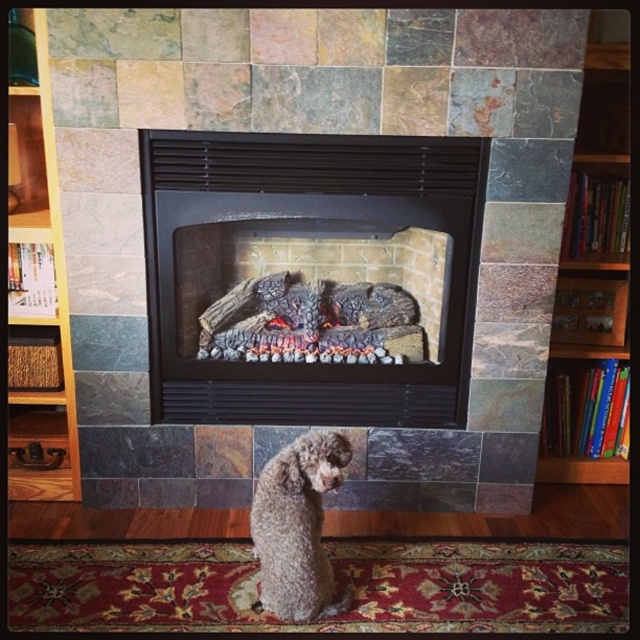
You are a guest in this living room and want to know which object takes up more space in the scene. Which one is bigger between the black matte fireplace at center and the gray curly fur dog at center?

Answer: The black matte fireplace at center is larger in size than the gray curly fur dog at center, so the fireplace takes up more space in the scene.

You are a guest in this living room and want to place a decorative item between the black matte fireplace at center and the brown wooden bookshelf at right. Based on their positions, which side of the fireplace should the item be placed on?

The black matte fireplace at center is to the left of the brown wooden bookshelf at right, so the decorative item should be placed to the right side of the black matte fireplace at center.

You are a guest in this living room and want to pet the gray curly fur dog at center. To reach it, you must walk around the brown wooden bookshelf at right. Which direction should you walk around the bookshelf to approach the dog?

Since the gray curly fur dog at center is behind the brown wooden bookshelf at right, you should walk around the right side of the brown wooden bookshelf at right to approach the dog.